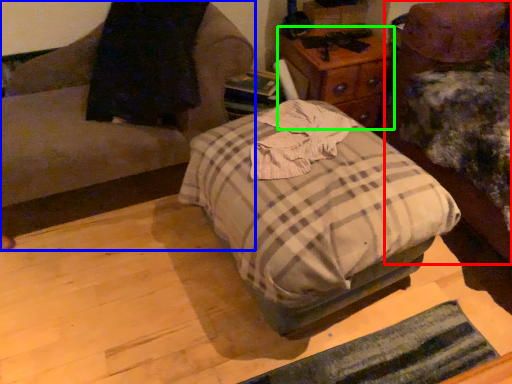
Question: Estimate the real-world distances between objects in this image. Which object is farther from furniture (highlighted by a red box), furniture (highlighted by a blue box) or nightstand (highlighted by a green box)?

Choices:
 (A) furniture
 (B) nightstand

Answer: (A)